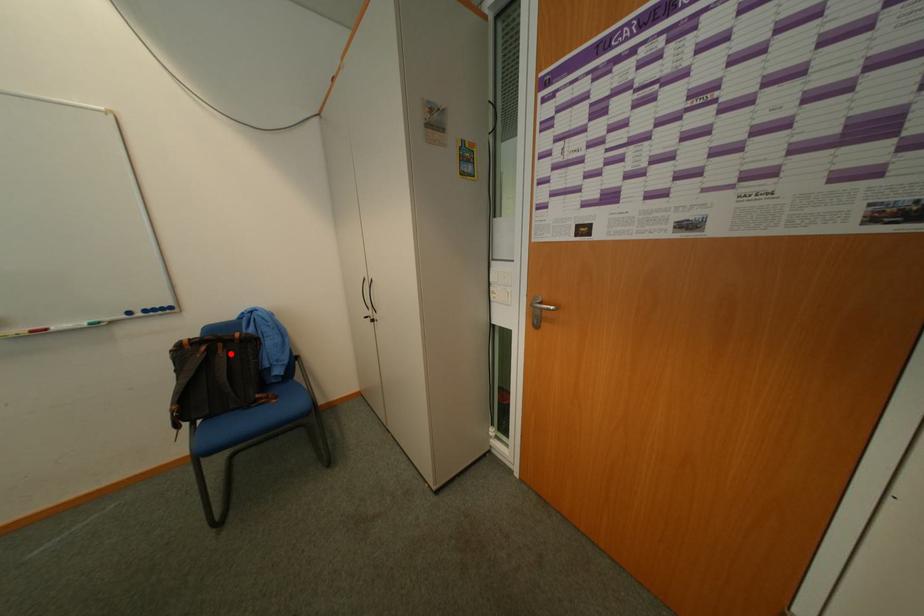
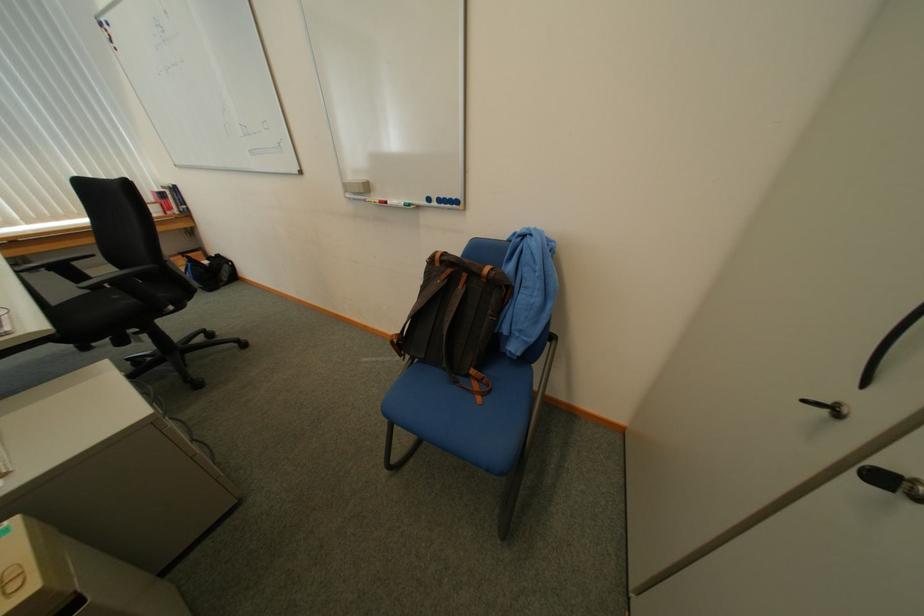
Where in the second image is the point corresponding to the highlighted location from the first image?

(469, 290)